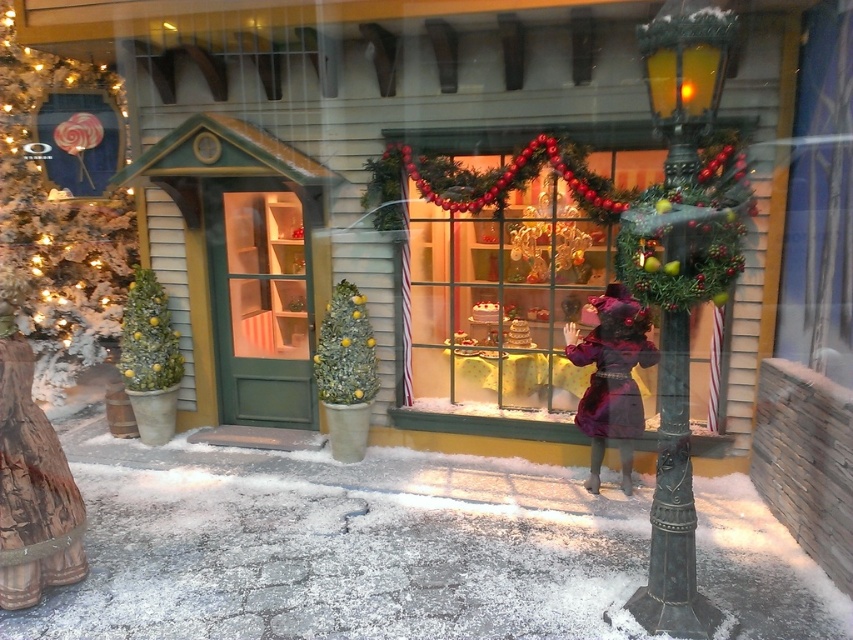
Question: Does velvet purple coat at center have a lesser width compared to green matte christmas tree at left?

Choices:
 (A) no
 (B) yes

Answer: (A)

Question: Estimate the real-world distances between objects in this image. Which object is closer to the velvet purple coat at center?

Choices:
 (A) green metal lamp post at right
 (B) green matte christmas tree at left
 (C) green matte christmas tree at center

Answer: (A)

Question: Can you confirm if green metal lamp post at right is positioned above velvet purple coat at center?

Choices:
 (A) yes
 (B) no

Answer: (B)

Question: Which object is positioned closest to the velvet purple coat at center?

Choices:
 (A) green metal lamp post at right
 (B) green matte christmas tree at center
 (C) green matte christmas tree at left

Answer: (A)

Question: Which point is closer to the camera?

Choices:
 (A) coord(148,364)
 (B) coord(619,372)
 (C) coord(689,35)

Answer: (C)

Question: Is green metal lamp post at right above velvet purple coat at center?

Choices:
 (A) yes
 (B) no

Answer: (B)